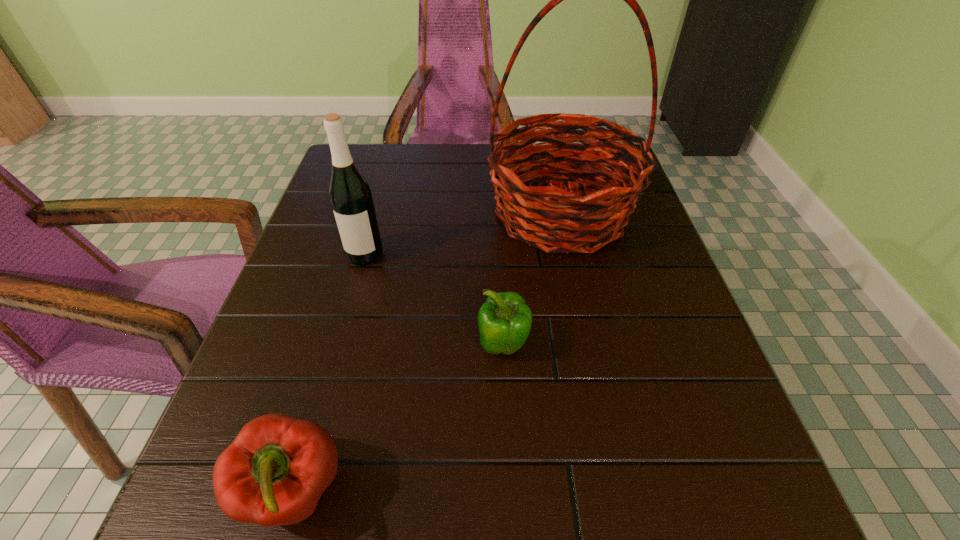
You are a GUI agent. You are given a task and a screenshot of the screen. Output one action in this format:
    pyautogui.click(x=<x>, y=<y>)
    Task: Click on the object at the far right corner
    The image size is (960, 540).
    Given the screenshot: What is the action you would take?
    pyautogui.click(x=546, y=218)

In the image, there is a desktop. At what (x,y) coordinates should I click in order to perform the action: click on free space at the far edge. Please return your answer as a coordinate pair (x, y). This screenshot has height=540, width=960. Looking at the image, I should click on (425, 190).

You are a GUI agent. You are given a task and a screenshot of the screen. Output one action in this format:
    pyautogui.click(x=<x>, y=<y>)
    Task: Click on the free region at the near edge of the desktop
    This screenshot has width=960, height=540.
    Given the screenshot: What is the action you would take?
    pyautogui.click(x=411, y=528)

Identify the location of vacant point at the left edge. The image size is (960, 540). (329, 214).

In the image, there is a desktop. At what (x,y) coordinates should I click in order to perform the action: click on free space at the right edge. Please return your answer as a coordinate pair (x, y). This screenshot has width=960, height=540. Looking at the image, I should click on (600, 254).

At what (x,y) coordinates should I click in order to perform the action: click on free space at the far left corner. Please return your answer as a coordinate pair (x, y). Looking at the image, I should click on (367, 143).

Identify the location of vacant area at the near right corner. The height and width of the screenshot is (540, 960). (655, 492).

Identify the location of empty location between the wine bottle and the right bell pepper. The width and height of the screenshot is (960, 540). (434, 300).

Identify the location of free spot between the farther bell pepper and the tallest object. Image resolution: width=960 pixels, height=540 pixels. (532, 280).

Locate an element on the screen. The height and width of the screenshot is (540, 960). vacant point located between the third shortest object and the basket is located at coordinates (463, 234).